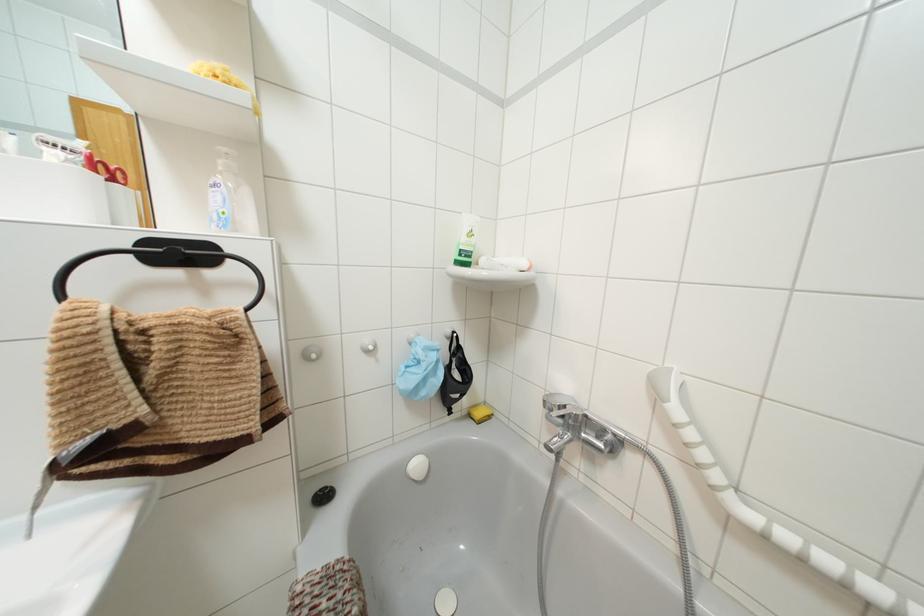
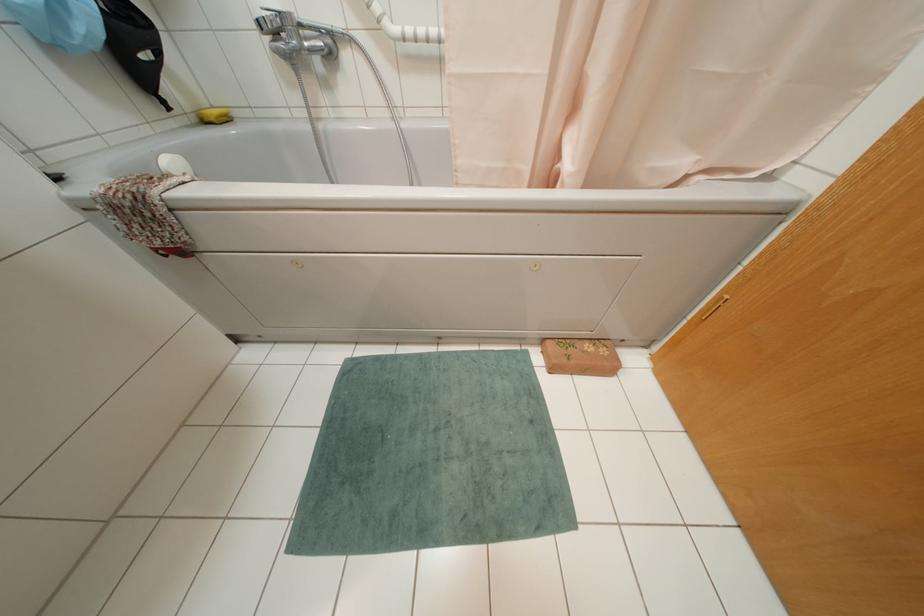
Find the pixel in the second image that matches point (468, 416) in the first image.

(202, 121)